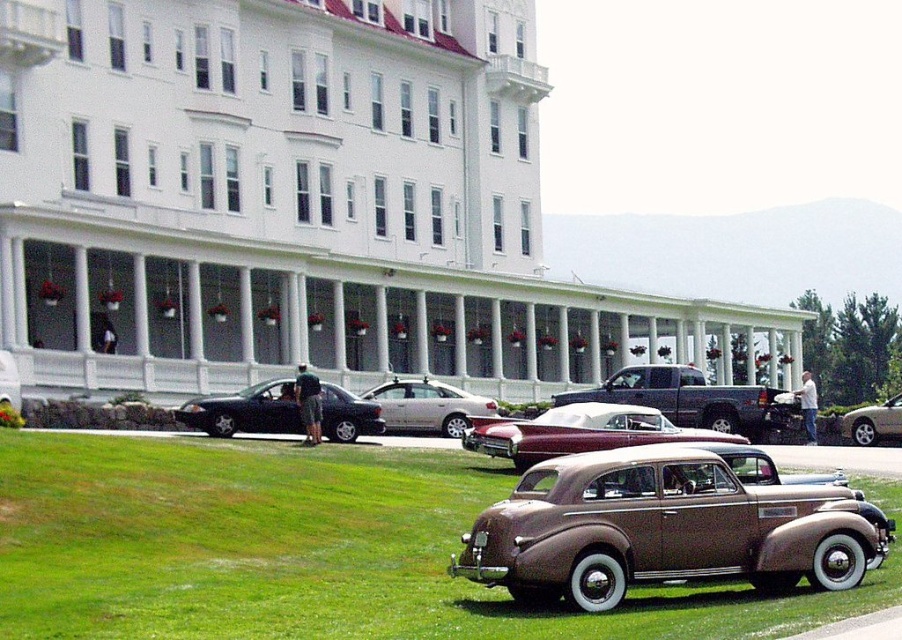
Where is `shiny gold sedan at center`? shiny gold sedan at center is located at coordinates click(x=661, y=529).

Is shiny gold sedan at center wider than maroon leather convertible at center?

Incorrect, shiny gold sedan at center's width does not surpass maroon leather convertible at center's.

Does point (613, 452) lie behind point (600, 404)?

That is False.

The width and height of the screenshot is (902, 640). What are the coordinates of `shiny gold sedan at center` in the screenshot? It's located at (661, 529).

Between point (256, 621) and point (542, 468), which one is positioned behind?

Point (542, 468)

Does brown metallic car at center have a greater height compared to shiny gold sedan at center?

Incorrect, brown metallic car at center's height is not larger of shiny gold sedan at center's.

Identify the location of brown metallic car at center. (310, 548).

Locate an element on the screen. The width and height of the screenshot is (902, 640). brown metallic car at center is located at coordinates (310, 548).

Can you confirm if shiny silver sedan at center is positioned to the left of silver metallic sedan at center?

In fact, shiny silver sedan at center is to the right of silver metallic sedan at center.

Find the location of a particular element. shiny silver sedan at center is located at coordinates (695, 401).

Does point (724, 387) come farther from viewer compared to point (451, 420)?

No, (724, 387) is closer to viewer.

Locate an element on the screen. This screenshot has height=640, width=902. shiny silver sedan at center is located at coordinates (695, 401).